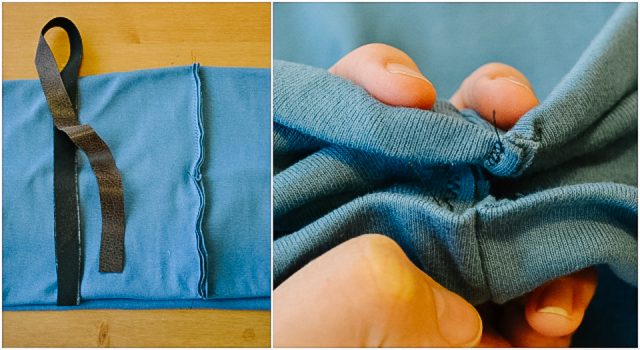
Locate an element on the screen. The height and width of the screenshot is (350, 640). table is located at coordinates (150, 45).